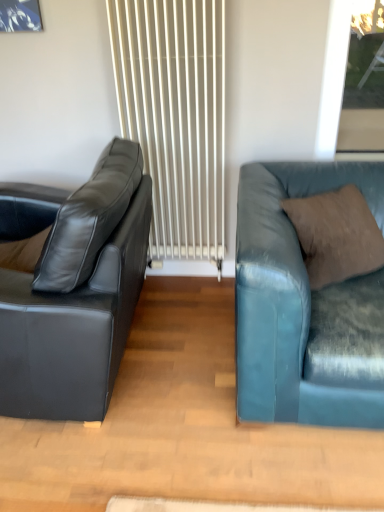
Question: Should I look upward or downward to see white textured radiator at center?

Choices:
 (A) up
 (B) down

Answer: (A)

Question: Is matte black leather couch at left, which is the first studio couch in left-to-right order, bigger than white textured radiator at center?

Choices:
 (A) no
 (B) yes

Answer: (B)

Question: Is matte black leather couch at left, the second studio couch positioned from the right, touching white textured radiator at center?

Choices:
 (A) yes
 (B) no

Answer: (B)

Question: Would you consider matte black leather couch at left, the second studio couch positioned from the right, to be distant from white textured radiator at center?

Choices:
 (A) no
 (B) yes

Answer: (A)

Question: Is matte black leather couch at left, which is the first studio couch in left-to-right order, at the right side of white textured radiator at center?

Choices:
 (A) yes
 (B) no

Answer: (B)

Question: Is white textured radiator at center located within matte black leather couch at left, the second studio couch positioned from the right?

Choices:
 (A) no
 (B) yes

Answer: (A)

Question: Does matte black leather couch at left, the second studio couch positioned from the right, have a lesser width compared to white textured radiator at center?

Choices:
 (A) yes
 (B) no

Answer: (B)

Question: Does teal leather couch at right, the 1th studio couch from the right, have a lesser width compared to matte black leather couch at left, the second studio couch positioned from the right?

Choices:
 (A) yes
 (B) no

Answer: (B)

Question: Does teal leather couch at right, the 1th studio couch from the right, have a greater height compared to matte black leather couch at left, the second studio couch positioned from the right?

Choices:
 (A) yes
 (B) no

Answer: (B)

Question: Considering the relative sizes of teal leather couch at right, the 2th studio couch positioned from the left, and matte black leather couch at left, the second studio couch positioned from the right, in the image provided, is teal leather couch at right, the 2th studio couch positioned from the left, bigger than matte black leather couch at left, the second studio couch positioned from the right,?

Choices:
 (A) no
 (B) yes

Answer: (A)

Question: Could you tell me if teal leather couch at right, the 2th studio couch positioned from the left, is facing matte black leather couch at left, which is the first studio couch in left-to-right order?

Choices:
 (A) no
 (B) yes

Answer: (A)

Question: Is teal leather couch at right, the 1th studio couch from the right, surrounding matte black leather couch at left, which is the first studio couch in left-to-right order?

Choices:
 (A) no
 (B) yes

Answer: (A)

Question: Is teal leather couch at right, the 2th studio couch positioned from the left, positioned far away from matte black leather couch at left, the second studio couch positioned from the right?

Choices:
 (A) yes
 (B) no

Answer: (B)

Question: Does teal leather couch at right, the 1th studio couch from the right, have a greater height compared to brown suede pillow at right?

Choices:
 (A) yes
 (B) no

Answer: (A)